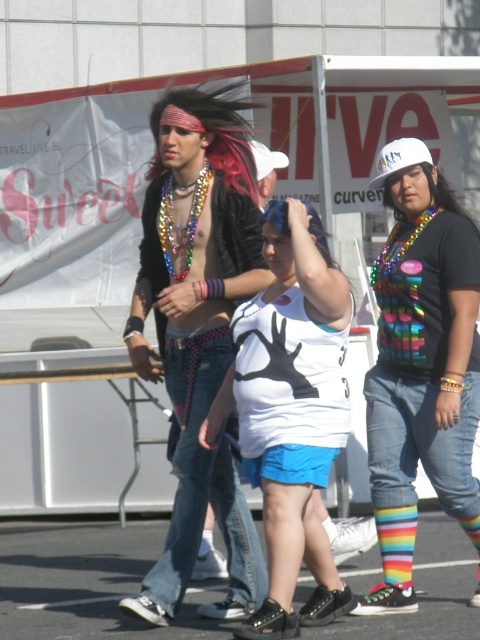
Who is shorter, shiny multicolored beads at center or white matte tank top at center?

With less height is white matte tank top at center.

Who is positioned more to the right, shiny multicolored beads at center or white matte tank top at center?

white matte tank top at center is more to the right.

Image resolution: width=480 pixels, height=640 pixels. What do you see at coordinates (197, 330) in the screenshot? I see `shiny multicolored beads at center` at bounding box center [197, 330].

Locate an element on the screen. This screenshot has height=640, width=480. shiny multicolored beads at center is located at coordinates (197, 330).

The height and width of the screenshot is (640, 480). Describe the element at coordinates (197, 330) in the screenshot. I see `shiny multicolored beads at center` at that location.

Is point (145, 237) in front of point (382, 170)?

No, it is behind (382, 170).

Which is in front, point (210, 381) or point (410, 154)?

Positioned in front is point (210, 381).

Locate an element on the screen. shiny multicolored beads at center is located at coordinates tap(197, 330).

Does white matte tank top at center have a greater height compared to rainbow striped socks at lower right?

Correct, white matte tank top at center is much taller as rainbow striped socks at lower right.

Is point (303, 458) positioned in front of point (404, 516)?

Yes.

Does point (312, 269) come in front of point (393, 582)?

Yes, point (312, 269) is in front of point (393, 582).

Identify the location of white matte tank top at center. [x=290, y=412].